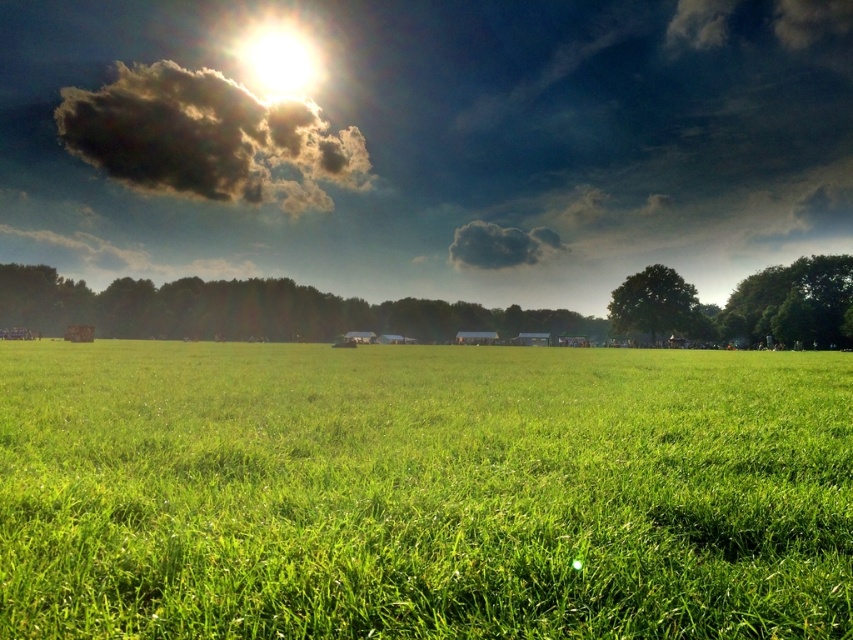
You are standing at the origin point of this outdoor scene. There are two points marked as point 1 at coordinates point (260, 35) and point 2 at coordinates point (511, 244). Which point is closer to you?

Point 2 at coordinates point (511, 244) is closer to you because it is in front of point 1 at coordinates point (260, 35).

You are standing in the middle of the green grassy pasture at center and looking towards the dark fluffy cloud at upper center. Which direction should you walk to get closer to the cloud?

You should walk to the left because the green grassy pasture at center is to the right of the dark fluffy cloud at upper center, meaning the cloud is to the left of your current position.

You are standing in the middle of the green grassy pasture at center and want to look at the bright sun at upper center. In which direction should you turn your head?

The green grassy pasture at center is to the right of the bright sun at upper center, so you should turn your head to the left to look at the bright sun at upper center.